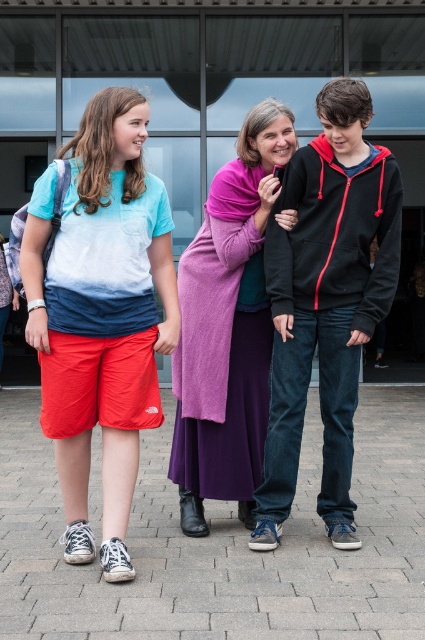
You are standing in the courtyard and need to locate the brick pavement at center. According to the coordinates given, where would you look?

You should look at point (221, 544) to find the brick pavement at center.

You are a delivery robot with a 3.5 feet wide package. You need to move from the brick pavement at center to the purple knit sweater at center. Can you fit through the space between them?

The distance between the brick pavement at center and the purple knit sweater at center is 3.79 feet, which is wider than the 3.5 feet wide package. Therefore, the delivery robot can fit through the space between them.